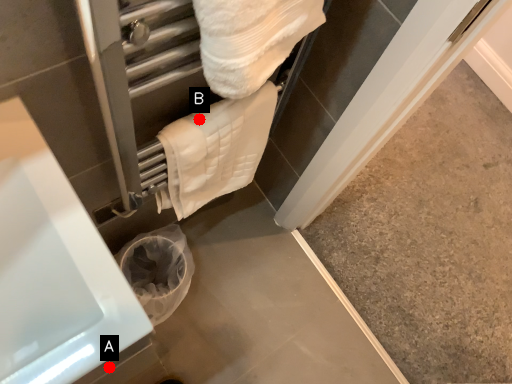
Question: Two points are circled on the image, labeled by A and B beside each circle. Among these points, which one is nearest to the camera?

Choices:
 (A) A is closer
 (B) B is closer

Answer: (B)